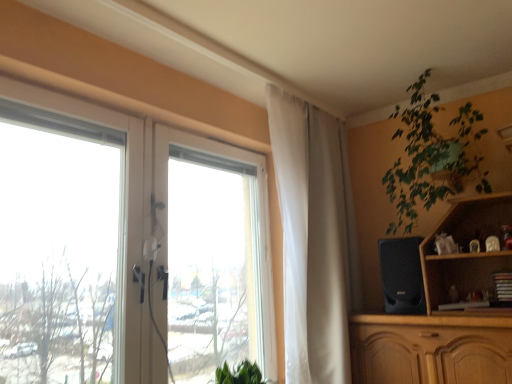
In order to face white sheer curtain at upper center, should I rotate leftwards or rightwards?

A 8.300 degree turn to the right will do.

The width and height of the screenshot is (512, 384). What are the coordinates of `green leafy plant at upper right` in the screenshot? It's located at (431, 157).

Locate an element on the screen. The width and height of the screenshot is (512, 384). white sheer curtain at upper center is located at coordinates (314, 239).

From a real-world perspective, which is physically above, white sheer curtain at upper center or green leafy plant at upper right?

green leafy plant at upper right is physically above.

At what (x,y) coordinates should I click in order to perform the action: click on curtain that appears below the green leafy plant at upper right (from a real-world perspective). Please return your answer as a coordinate pair (x, y). This screenshot has width=512, height=384. Looking at the image, I should click on (314, 239).

In terms of height, does white sheer curtain at upper center look taller or shorter compared to green leafy plant at upper right?

In the image, white sheer curtain at upper center appears to be taller than green leafy plant at upper right.

Is black matte speaker at right located outside white sheer curtain at upper center?

Yes, black matte speaker at right is located beyond the bounds of white sheer curtain at upper center.

Considering the positions of objects black matte speaker at right and white sheer curtain at upper center in the image provided, who is more to the left, black matte speaker at right or white sheer curtain at upper center?

Positioned to the left is white sheer curtain at upper center.

Considering the relative sizes of black matte speaker at right and white sheer curtain at upper center in the image provided, is black matte speaker at right wider than white sheer curtain at upper center?

Yes, black matte speaker at right is wider than white sheer curtain at upper center.

Is black matte speaker at right positioned far away from white sheer curtain at upper center?

They are positioned close to each other.

From a real-world perspective, is green leafy plant at upper right positioned under white sheer curtain at upper center based on gravity?

No, from a real-world perspective, green leafy plant at upper right is not under white sheer curtain at upper center.

Does green leafy plant at upper right turn towards white sheer curtain at upper center?

No, green leafy plant at upper right is not oriented towards white sheer curtain at upper center.

Identify the location of houseplant that appears on the right of white sheer curtain at upper center. The image size is (512, 384). click(x=431, y=157).

Can you tell me how much green leafy plant at upper right and white sheer curtain at upper center differ in facing direction?

There is a 90-degree angle between the facing directions of green leafy plant at upper right and white sheer curtain at upper center.

Is transparent glass window at left facing towards white sheer curtain at upper center?

Yes, transparent glass window at left is oriented towards white sheer curtain at upper center.

Based on the photo, are transparent glass window at left and white sheer curtain at upper center beside each other?

transparent glass window at left and white sheer curtain at upper center are not in contact.

Between transparent glass window at left and white sheer curtain at upper center, which one has more height?

white sheer curtain at upper center.

From a real-world perspective, which object stands above the other?

white sheer curtain at upper center.

From the image's perspective, who appears lower, white sheer curtain at upper center or transparent glass window at left?

transparent glass window at left, from the image's perspective.

In the scene shown: How different are the orientations of white sheer curtain at upper center and transparent glass window at left in degrees?

The angle between the facing direction of white sheer curtain at upper center and the facing direction of transparent glass window at left is 0.000433 degrees.

Considering the sizes of objects white sheer curtain at upper center and transparent glass window at left in the image provided, who is shorter, white sheer curtain at upper center or transparent glass window at left?

transparent glass window at left is shorter.

Which object is closer to the camera taking this photo, white sheer curtain at upper center or transparent glass window at left?

Positioned in front is transparent glass window at left.

From the image's perspective, would you say white sheer curtain at upper center is positioned over black matte speaker at right?

Yes, from the image's perspective, white sheer curtain at upper center is on top of black matte speaker at right.

Based on the photo, is the depth of white sheer curtain at upper center greater than that of black matte speaker at right?

That is False.

The width and height of the screenshot is (512, 384). I want to click on curtain located above the black matte speaker at right (from the image's perspective), so click(x=314, y=239).

Is black matte speaker at right far away from green leafy plant at upper right?

They are positioned close to each other.

From the image's perspective, is black matte speaker at right located beneath green leafy plant at upper right?

Yes.

Considering the relative sizes of black matte speaker at right and green leafy plant at upper right in the image provided, is black matte speaker at right bigger than green leafy plant at upper right?

No, black matte speaker at right is not bigger than green leafy plant at upper right.

In order to click on houseplant that appears above the white sheer curtain at upper center (from the image's perspective) in this screenshot , I will do `click(431, 157)`.

Image resolution: width=512 pixels, height=384 pixels. Find the location of `speaker that appears below the white sheer curtain at upper center (from the image's perspective)`. speaker that appears below the white sheer curtain at upper center (from the image's perspective) is located at coordinates (402, 275).

Based on their spatial positions, is white sheer curtain at upper center or green leafy plant at upper right further from black matte speaker at right?

white sheer curtain at upper center is further to black matte speaker at right.

Based on their spatial positions, is transparent glass window at left or green leafy plant at upper right further from white sheer curtain at upper center?

green leafy plant at upper right.

Considering their positions, is black matte speaker at right positioned further to transparent glass window at left than white sheer curtain at upper center?

Based on the image, black matte speaker at right appears to be further to transparent glass window at left.

Which object lies nearer to the anchor point green leafy plant at upper right, transparent glass window at left or white sheer curtain at upper center?

Among the two, white sheer curtain at upper center is located nearer to green leafy plant at upper right.

When comparing their distances from black matte speaker at right, does white sheer curtain at upper center or transparent glass window at left seem further?

transparent glass window at left is positioned further to the anchor black matte speaker at right.

Estimate the real-world distances between objects in this image. Which object is further from green leafy plant at upper right, black matte speaker at right or transparent glass window at left?

transparent glass window at left.

From the picture: Based on their spatial positions, is black matte speaker at right or green leafy plant at upper right closer to transparent glass window at left?

black matte speaker at right is positioned closer to the anchor transparent glass window at left.

Based on their spatial positions, is black matte speaker at right or green leafy plant at upper right closer to white sheer curtain at upper center?

Based on the image, black matte speaker at right appears to be nearer to white sheer curtain at upper center.

Image resolution: width=512 pixels, height=384 pixels. Find the location of `curtain between green leafy plant at upper right and black matte speaker at right in the vertical direction`. curtain between green leafy plant at upper right and black matte speaker at right in the vertical direction is located at coordinates (314, 239).

Identify the location of curtain between transparent glass window at left and green leafy plant at upper right in the horizontal direction. (314, 239).

Identify the location of curtain between transparent glass window at left and black matte speaker at right in the horizontal direction. The height and width of the screenshot is (384, 512). (314, 239).

Where is `speaker between transparent glass window at left and green leafy plant at upper right in the horizontal direction`? The width and height of the screenshot is (512, 384). speaker between transparent glass window at left and green leafy plant at upper right in the horizontal direction is located at coordinates (402, 275).